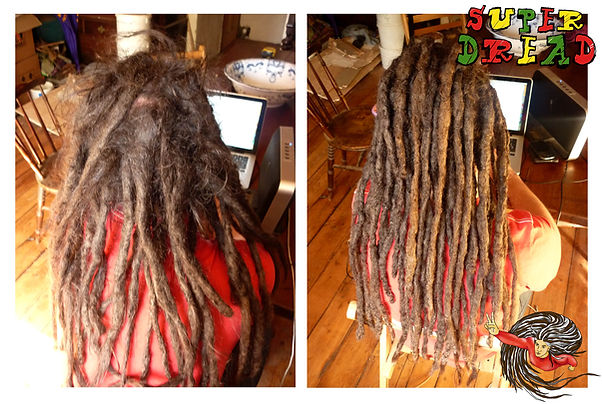
Where is `glass bowl`? The height and width of the screenshot is (404, 602). glass bowl is located at coordinates (259, 66).